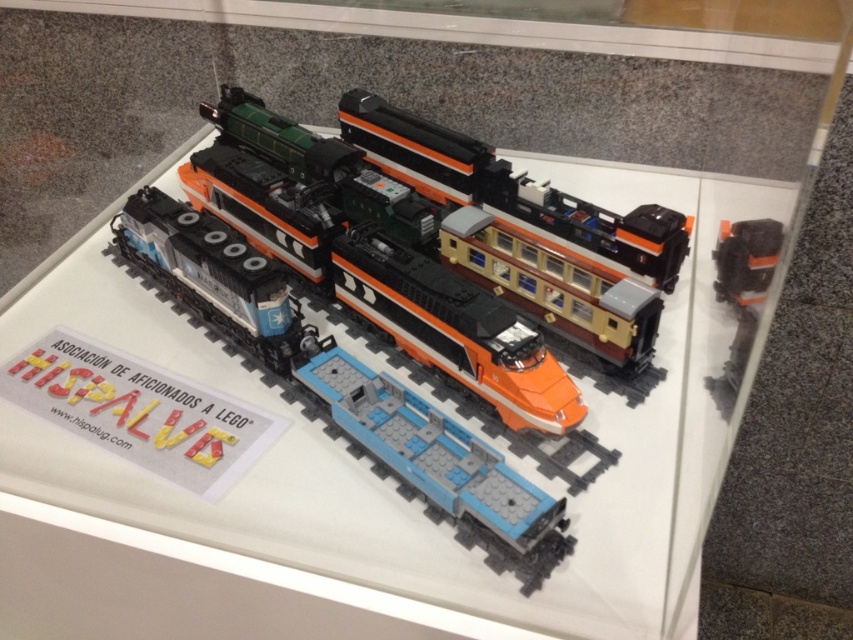
You are a photographer standing 40 inches away from the glass case containing the orange matte train at center. You want to take a closeup photo of the train without getting too close. Can you get within 3 inches of the train using your current position?

The orange matte train at center is 37.43 inches away from the camera. Since you are 40 inches away from the glass case, you are already 3 inches further than the train. To get within 3 inches of the train, you would need to move closer to the case, but you are already at 40 inches. Therefore, you cannot get closer than 37.43 inches from the train with your current position.

You are a visitor standing in front of the LEGO train set display. You notice the orange matte train at center and the orange matte train car at center. Which one is positioned to the left?

The orange matte train at center is positioned to the left of the orange matte train car at center.